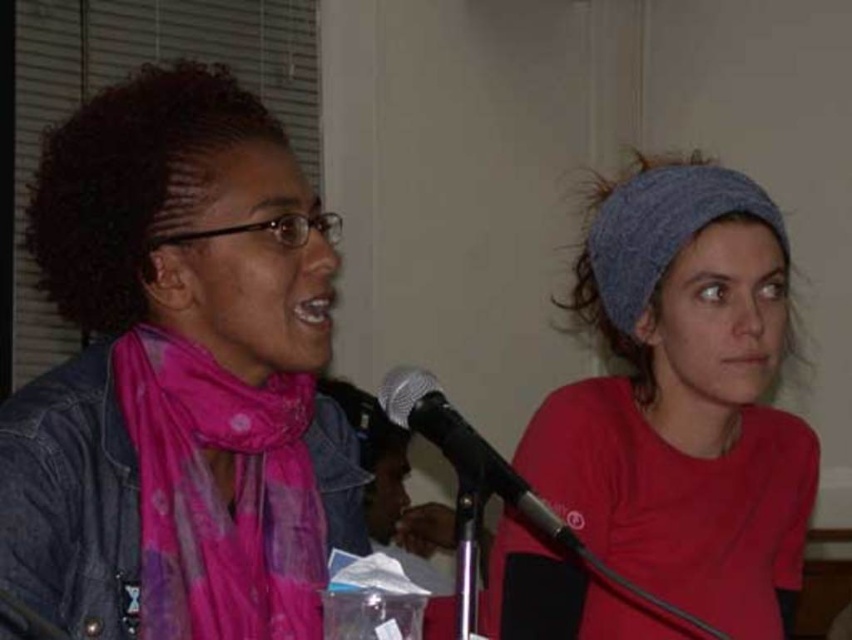
Can you confirm if pink fabric scarf at left is positioned to the right of red cotton t-shirt at center?

No, pink fabric scarf at left is not to the right of red cotton t-shirt at center.

Does pink fabric scarf at left have a greater width compared to red cotton t-shirt at center?

Incorrect, pink fabric scarf at left's width does not surpass red cotton t-shirt at center's.

Which is behind, point (148, 136) or point (689, 184)?

The point (689, 184) is behind.

The image size is (852, 640). Identify the location of pink fabric scarf at left. (179, 376).

Who is more forward, (616,488) or (159,330)?

Point (159,330)

Does red cotton t-shirt at center appear over pink sheer scarf at left?

Indeed, red cotton t-shirt at center is positioned over pink sheer scarf at left.

This screenshot has height=640, width=852. In order to click on red cotton t-shirt at center in this screenshot , I will do (683, 400).

Is pink fabric scarf at left smaller than pink sheer scarf at left?

Incorrect, pink fabric scarf at left is not smaller in size than pink sheer scarf at left.

Is point (262, 461) behind point (199, 552)?

Yes, it is.

Who is more forward, (272, 172) or (194, 372)?

Point (194, 372) is more forward.

Find the location of `pink fabric scarf at left`. pink fabric scarf at left is located at coordinates (179, 376).